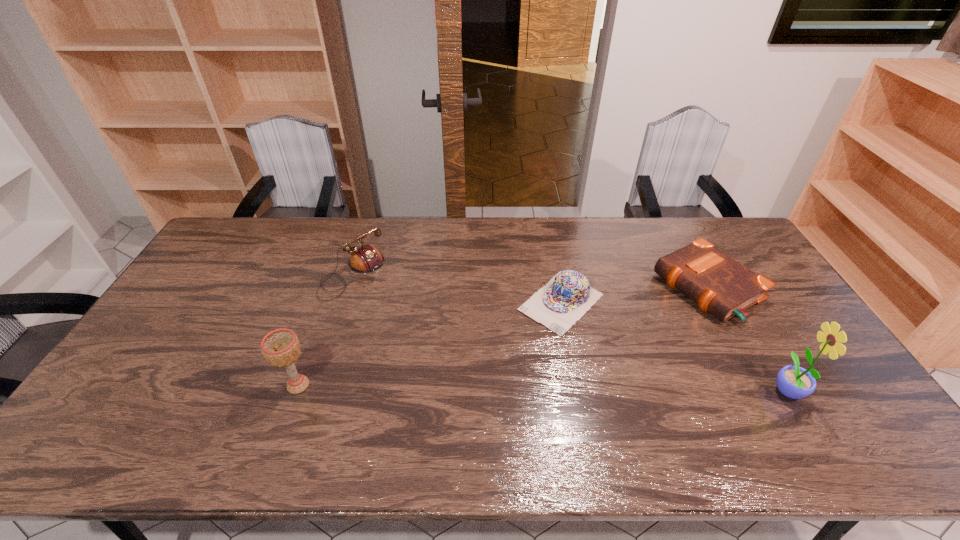
Identify the location of vacant area that lies between the sunflower and the Bible. (747, 338).

At what (x,y) coordinates should I click in order to perform the action: click on free space that is in between the telephone and the tallest object. Please return your answer as a coordinate pair (x, y). This screenshot has height=540, width=960. Looking at the image, I should click on (569, 332).

This screenshot has height=540, width=960. I want to click on vacant area between the Bible and the fourth shortest object, so coord(503,336).

The image size is (960, 540). Find the location of `free space between the telephone and the fourth shortest object`. free space between the telephone and the fourth shortest object is located at coordinates (325, 330).

Where is `vacant area between the telephone and the Bible`? Image resolution: width=960 pixels, height=540 pixels. vacant area between the telephone and the Bible is located at coordinates pos(530,281).

Where is `empty location between the chalice and the Bible`? The width and height of the screenshot is (960, 540). empty location between the chalice and the Bible is located at coordinates (503, 336).

You are a GUI agent. You are given a task and a screenshot of the screen. Output one action in this format:
    pyautogui.click(x=<x>, y=<y>)
    Task: Click on the vacant space that's between the third tallest object and the tallest object
    The width and height of the screenshot is (960, 540).
    Given the screenshot: What is the action you would take?
    pyautogui.click(x=569, y=332)

Find the location of a particular element. Image resolution: width=960 pixels, height=540 pixels. empty space that is in between the Bible and the cap is located at coordinates (635, 295).

Where is `free space between the sunflower and the Bible`? This screenshot has height=540, width=960. free space between the sunflower and the Bible is located at coordinates (747, 338).

Find the location of a particular element. object identified as the closest to the telephone is located at coordinates (281, 347).